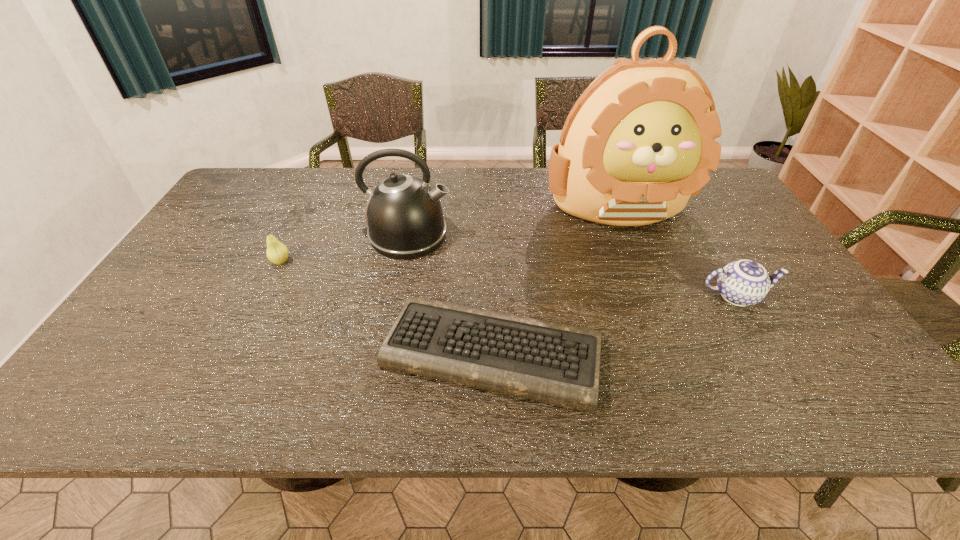
This screenshot has height=540, width=960. What are the coordinates of `vacant space at the far right corner of the desktop` in the screenshot? It's located at (706, 202).

Identify the location of free space at the near right corner. (859, 396).

Where is `empty location between the fourth shortest object and the chinaware`? This screenshot has width=960, height=540. empty location between the fourth shortest object and the chinaware is located at coordinates (572, 266).

Where is `blank region between the tallest object and the fourth shortest object`? This screenshot has height=540, width=960. blank region between the tallest object and the fourth shortest object is located at coordinates (513, 220).

You are a GUI agent. You are given a task and a screenshot of the screen. Output one action in this format:
    pyautogui.click(x=<x>, y=<y>)
    Task: Click on the free space between the shortest object and the pear
    Image resolution: width=960 pixels, height=540 pixels.
    Given the screenshot: What is the action you would take?
    pyautogui.click(x=387, y=307)

This screenshot has width=960, height=540. Identify the location of free space between the leftmost object and the backpack. (x=449, y=233).

Find the location of a particular element. blank region between the pear and the backpack is located at coordinates (449, 233).

Locate an element on the screen. Image resolution: width=960 pixels, height=540 pixels. vacant point located between the computer keyboard and the kettle is located at coordinates (450, 294).

Where is `free space between the fourth shortest object and the tallest object`? free space between the fourth shortest object and the tallest object is located at coordinates (513, 220).

The height and width of the screenshot is (540, 960). I want to click on free space between the computer keyboard and the leftmost object, so click(387, 307).